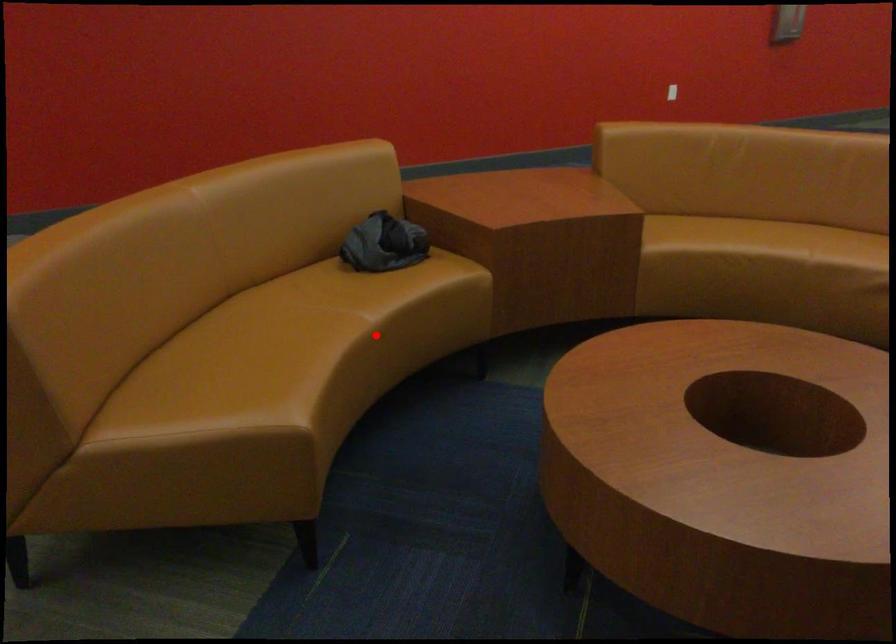
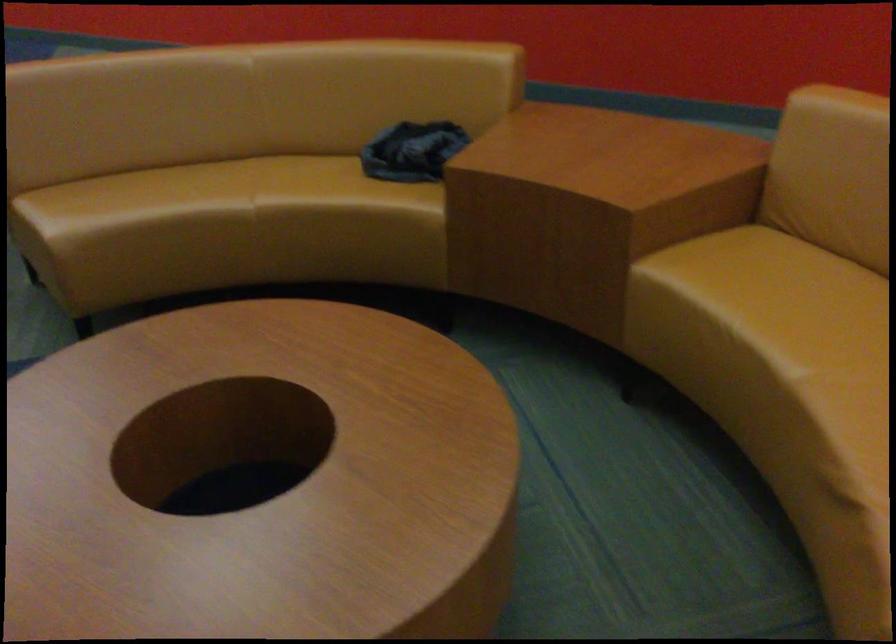
Where in the second image is the point corresponding to the highlighted location from the first image?

(255, 220)